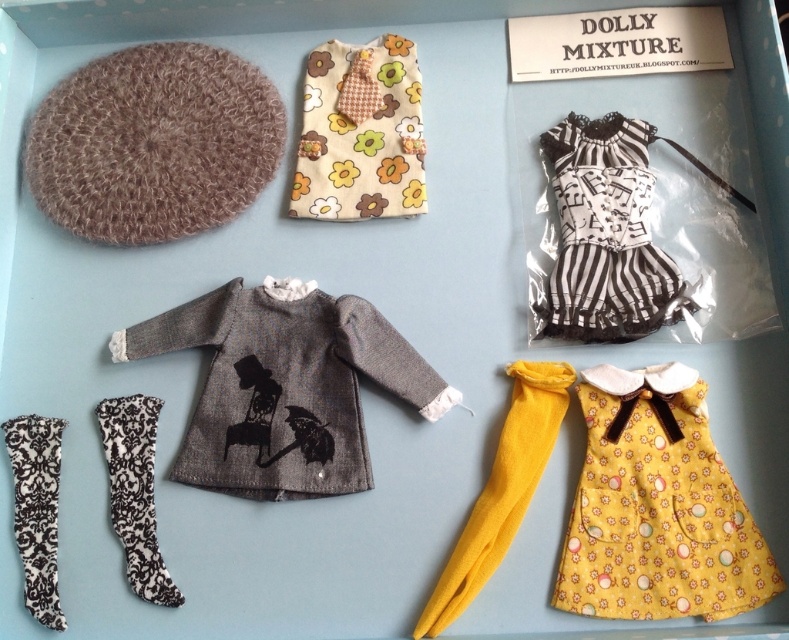
You are a dollhouse collector who wants to place a new knitted gray sweater at center into your collection. The space you have available is 1 meter wide. Can the sweater fit in the space?

The distance between the knitted gray sweater at center and the viewer is 1.11 meters, which is wider than the available 1 meter space. Therefore, the sweater cannot fit in the space.

You are a doll owner who wants to store your doll in a vertical storage unit. The unit has a height limit of 12 inches. You have the black and white striped dress at upper right and the black damask sock at lower left. Which item might not fit in the storage unit based on their heights?

The black and white striped dress at upper right is much taller than the black damask sock at lower left. Since the storage unit has a height limit of 12 inches, the black and white striped dress at upper right might not fit due to its greater height.